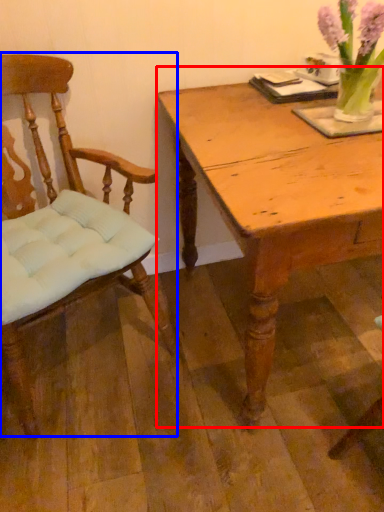
Question: Which object appears closest to the camera in this image, table (highlighted by a red box) or chair (highlighted by a blue box)?

Choices:
 (A) table
 (B) chair

Answer: (B)